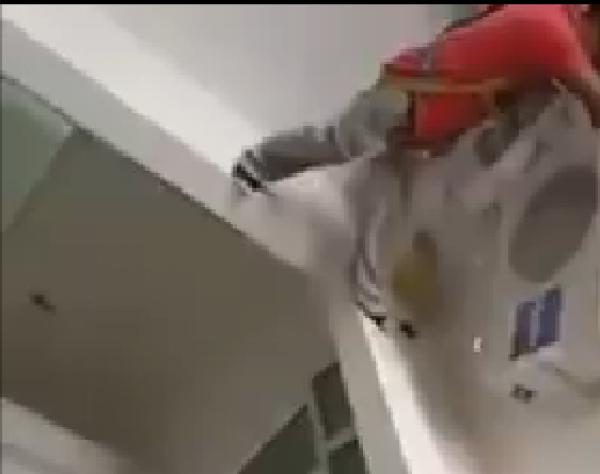
This screenshot has height=474, width=600. What are the coordinates of `ceiling` in the screenshot? It's located at (276, 52).